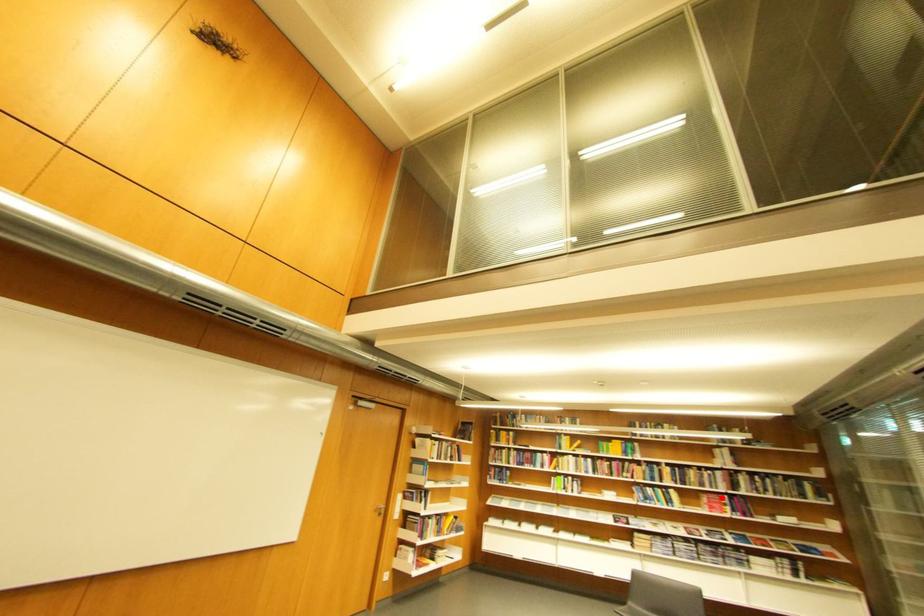
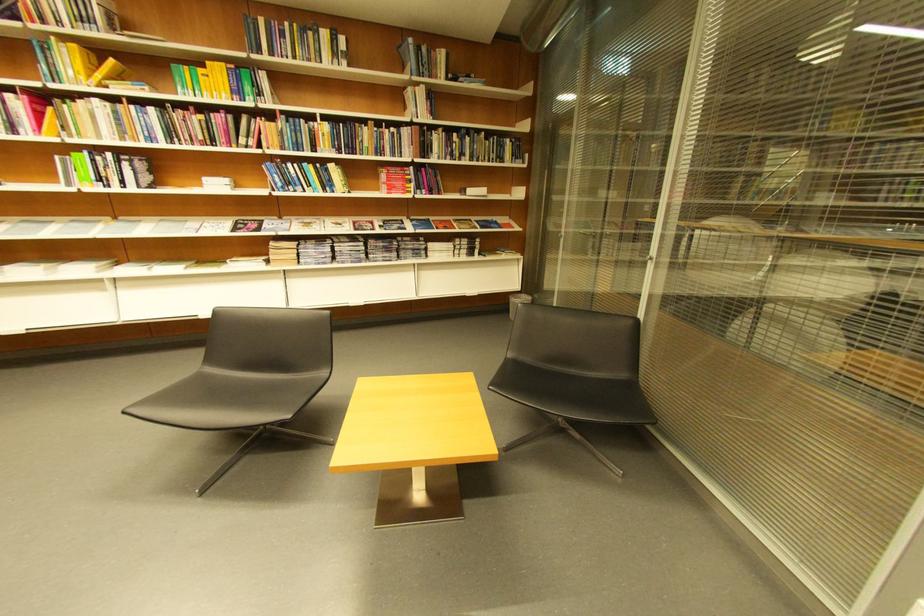
Question: I am providing you with two images of the same scene from different viewpoints. Image1 has a red point marked. In image2, the corresponding 3D location appears at what relative position? Reply with the corresponding letter.

Choices:
 (A) Closer
 (B) Farther

Answer: (A)